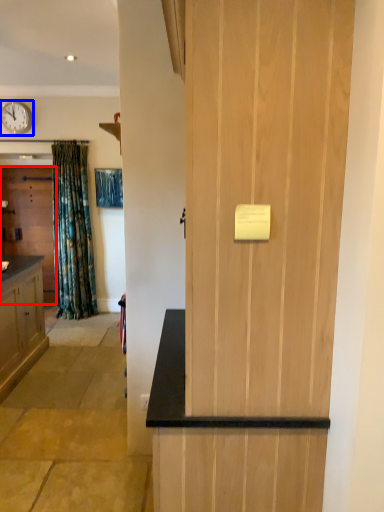
Question: Which object is closer to the camera taking this photo, door (highlighted by a red box) or clock (highlighted by a blue box)?

Choices:
 (A) door
 (B) clock

Answer: (B)